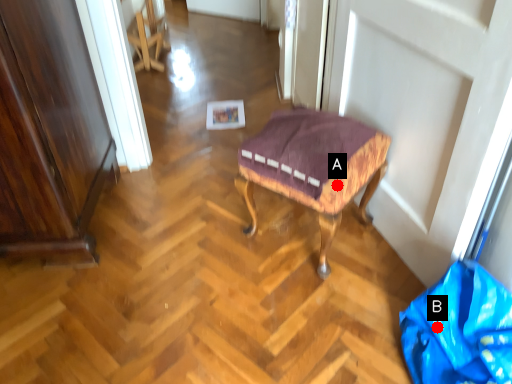
Question: Two points are circled on the image, labeled by A and B beside each circle. Among these points, which one is farthest from the camera?

Choices:
 (A) A is further
 (B) B is further

Answer: (A)